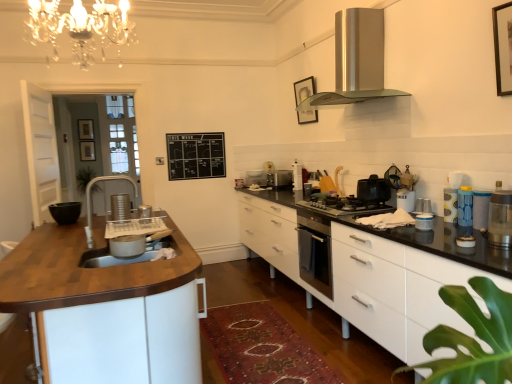
Locate an element on the screen. The height and width of the screenshot is (384, 512). free area behind blue plastic container at right, the 10th appliance from the back is located at coordinates (408, 218).